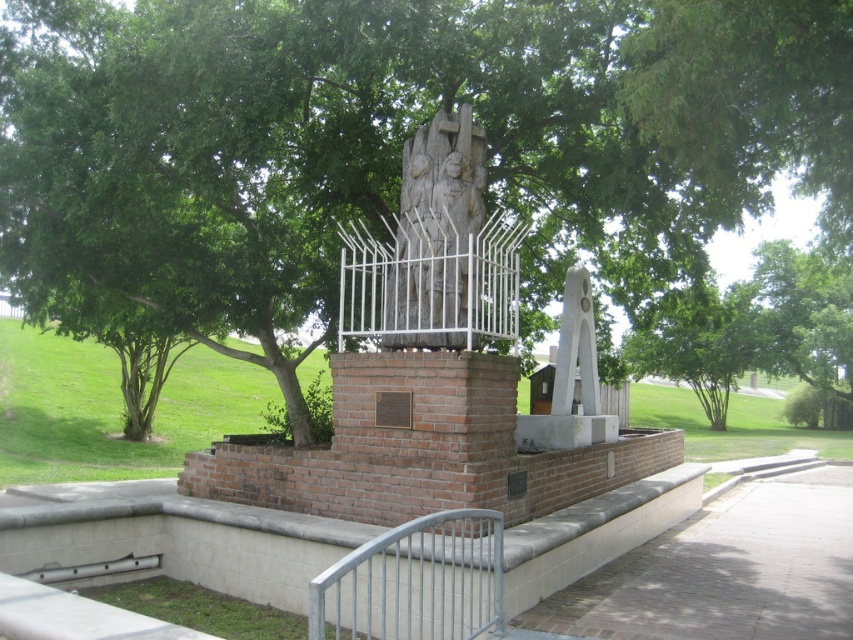
Can you confirm if green leafy tree at center is thinner than white metal fence at center?

Incorrect, green leafy tree at center's width is not less than white metal fence at center's.

Is point (473, 58) more distant than point (381, 276)?

No.

Find the location of a particular element. This screenshot has height=640, width=853. green leafy tree at center is located at coordinates click(x=399, y=131).

Who is higher up, silver metallic fence at lower center or white marble clock at center?

white marble clock at center is higher up.

Does silver metallic fence at lower center appear over white marble clock at center?

Actually, silver metallic fence at lower center is below white marble clock at center.

I want to click on silver metallic fence at lower center, so click(x=415, y=580).

Which is more to the right, white metal fence at center or white marble clock at center?

From the viewer's perspective, white marble clock at center appears more on the right side.

Between white metal fence at center and white marble clock at center, which one has less height?

Standing shorter between the two is white metal fence at center.

The image size is (853, 640). Identify the location of white metal fence at center. (430, 280).

Locate an element on the screen. white metal fence at center is located at coordinates (430, 280).